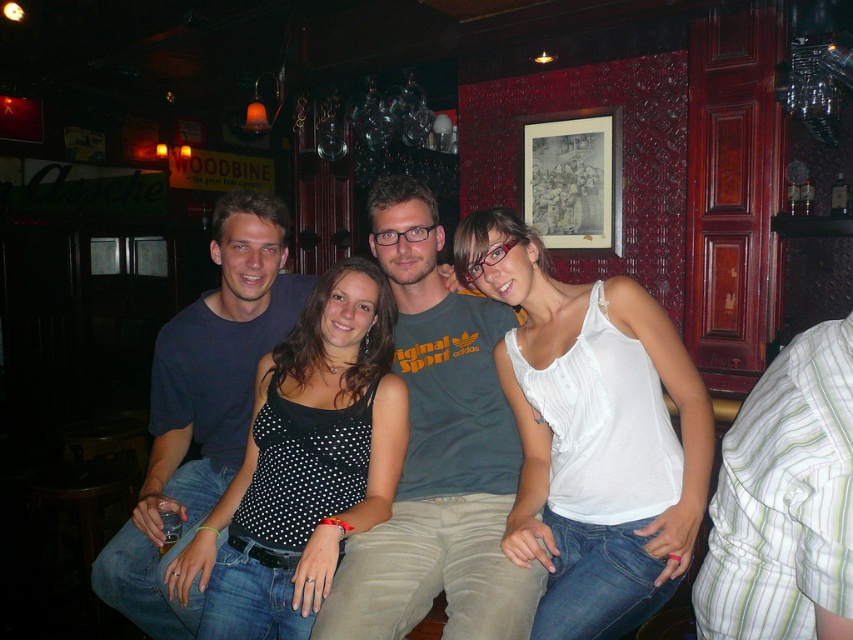
Question: Which of the following is the farthest from the observer?

Choices:
 (A) dark gray cotton t-shirt at center
 (B) white cotton tank top at center
 (C) dark blue t-shirt at center
 (D) black dotted tank top at center

Answer: (C)

Question: From the image, what is the correct spatial relationship of white cotton tank top at center in relation to dark gray cotton t-shirt at center?

Choices:
 (A) below
 (B) above

Answer: (B)

Question: Does dark gray cotton t-shirt at center appear on the right side of black dotted tank top at center?

Choices:
 (A) no
 (B) yes

Answer: (B)

Question: Which object is the farthest from the white cotton tank top at center?

Choices:
 (A) dark gray cotton t-shirt at center
 (B) dark blue t-shirt at center

Answer: (B)

Question: Is white cotton tank top at center thinner than black dotted tank top at center?

Choices:
 (A) no
 (B) yes

Answer: (A)

Question: Which point appears farthest from the camera in this image?

Choices:
 (A) (625, 333)
 (B) (251, 451)

Answer: (B)